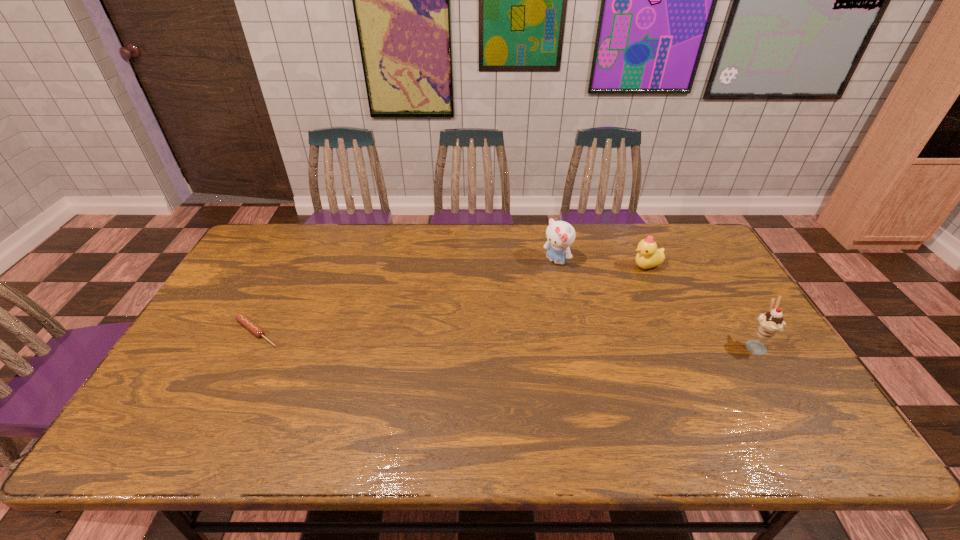
Identify the location of vacant point located between the third object from left to right and the shortest object. This screenshot has height=540, width=960. (451, 299).

I want to click on free space that is in between the shortest object and the kitten, so click(x=406, y=297).

Locate an element on the screen. The height and width of the screenshot is (540, 960). vacant region between the second object from right to left and the icecream is located at coordinates (700, 306).

Identify which object is the closest to the third object from right to left. Please provide its 2D coordinates. Your answer should be formatted as a tuple, i.e. [(x, y)], where the tuple contains the x and y coordinates of a point satisfying the conditions above.

[(648, 256)]

Point out which object is positioned as the second nearest to the rightmost object. Please provide its 2D coordinates. Your answer should be formatted as a tuple, i.e. [(x, y)], where the tuple contains the x and y coordinates of a point satisfying the conditions above.

[(560, 235)]

Locate an element on the screen. The width and height of the screenshot is (960, 540). free location that satisfies the following two spatial constraints: 1. on the front side of the second shortest object; 2. on the right side of the icecream is located at coordinates [x=681, y=345].